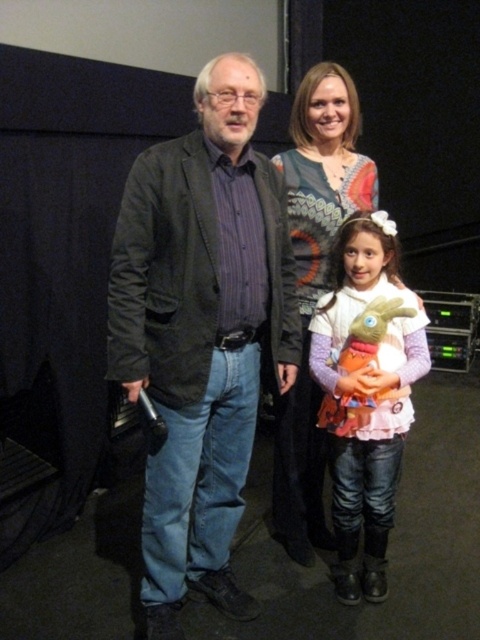
Question: Which of the following is the closest to the observer?

Choices:
 (A) (336, 394)
 (B) (343, 172)

Answer: (A)

Question: Is pink fluffy dress at center to the left of knitted sweater at center from the viewer's perspective?

Choices:
 (A) yes
 (B) no

Answer: (B)

Question: Is dark gray textured blazer at center smaller than pink fluffy dress at center?

Choices:
 (A) no
 (B) yes

Answer: (A)

Question: Can you confirm if dark gray textured blazer at center is bigger than pink fluffy dress at center?

Choices:
 (A) yes
 (B) no

Answer: (A)

Question: Based on their relative distances, which object is farther from the knitted sweater at center?

Choices:
 (A) pink fluffy dress at center
 (B) dark gray textured blazer at center

Answer: (B)

Question: Which object is farther from the camera taking this photo?

Choices:
 (A) knitted sweater at center
 (B) pink fluffy dress at center
 (C) dark gray textured blazer at center

Answer: (A)